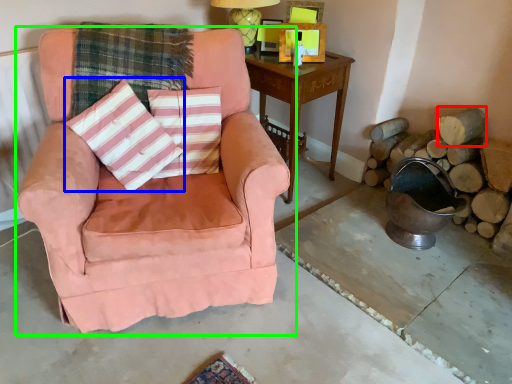
Question: Which is farther away from wood (highlighted by a red box)? throw pillow (highlighted by a blue box) or chair (highlighted by a green box)?

Choices:
 (A) throw pillow
 (B) chair

Answer: (A)